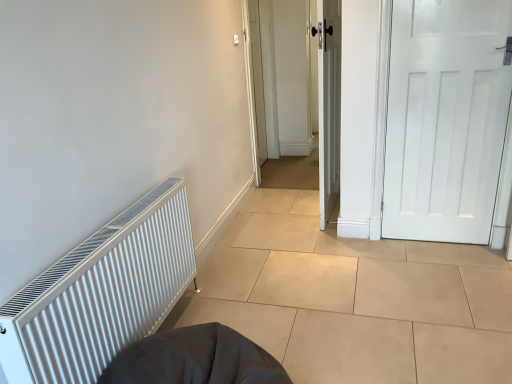
Question: Is dark gray fabric sleeping bag at lower center to the left or to the right of white wooden door at center, the first door from the left, in the image?

Choices:
 (A) right
 (B) left

Answer: (B)

Question: From a real-world perspective, relative to white wooden door at center, the first door from the left, is dark gray fabric sleeping bag at lower center vertically above or below?

Choices:
 (A) above
 (B) below

Answer: (B)

Question: Which object is the farthest from the dark gray fabric sleeping bag at lower center?

Choices:
 (A) white ribbed radiator at left
 (B) white matte door at right, which appears as the 2th door when viewed from the left
 (C) white matte radiator at left
 (D) white wooden door at center, the first door from the left

Answer: (B)

Question: Estimate the real-world distances between objects in this image. Which object is farther from the white ribbed radiator at left?

Choices:
 (A) dark gray fabric sleeping bag at lower center
 (B) white matte door at right, arranged as the 1th door when viewed from the right
 (C) white matte radiator at left
 (D) white wooden door at center, the first door from the left

Answer: (B)